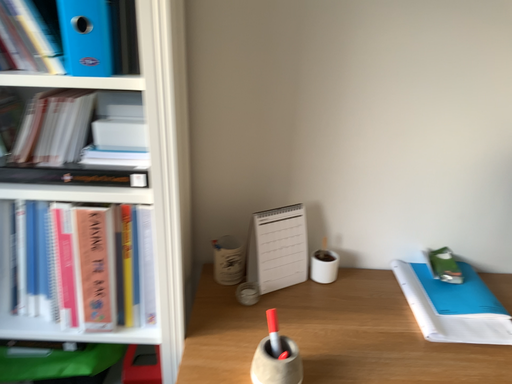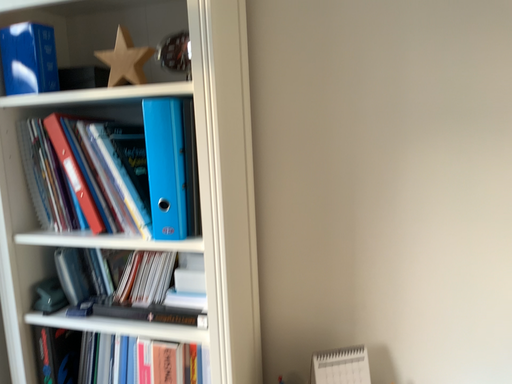
Question: Which way did the camera rotate in the video?

Choices:
 (A) rotated downward
 (B) rotated upward

Answer: (B)